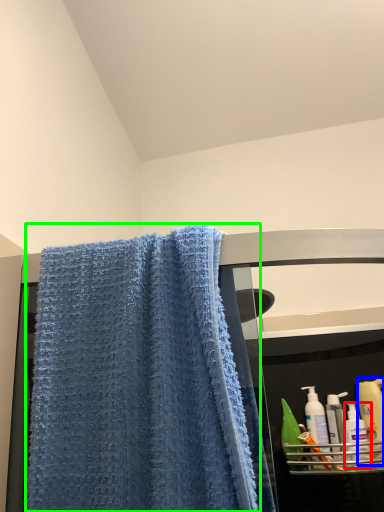
Question: Considering the real-world distances, which object is closest to cleaning product (highlighted by a red box)? cleaning product (highlighted by a blue box) or towel (highlighted by a green box).

Choices:
 (A) cleaning product
 (B) towel

Answer: (A)